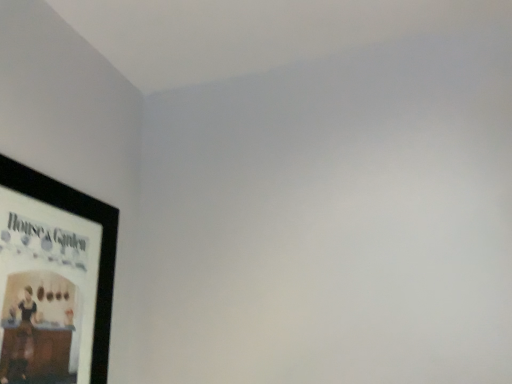
Where is `black matte picture frame at left`? black matte picture frame at left is located at coordinates (54, 280).

Describe the element at coordinates (54, 280) in the screenshot. I see `black matte picture frame at left` at that location.

This screenshot has height=384, width=512. What are the coordinates of `black matte picture frame at left` in the screenshot? It's located at (54, 280).